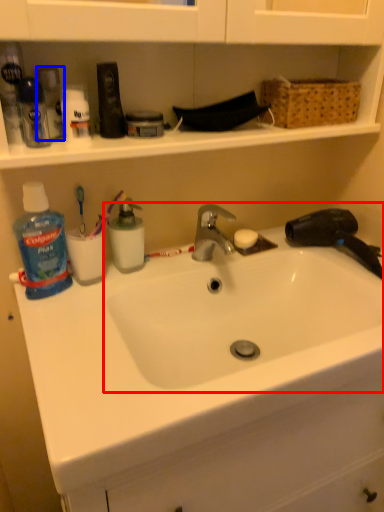
Question: Which point is further to the camera, sink (highlighted by a red box) or toiletry (highlighted by a blue box)?

Choices:
 (A) sink
 (B) toiletry

Answer: (B)